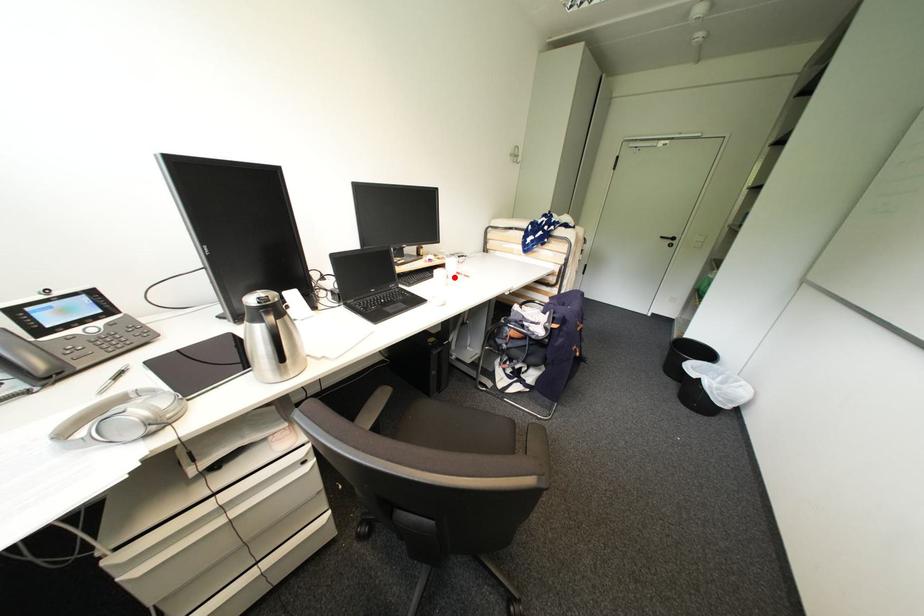
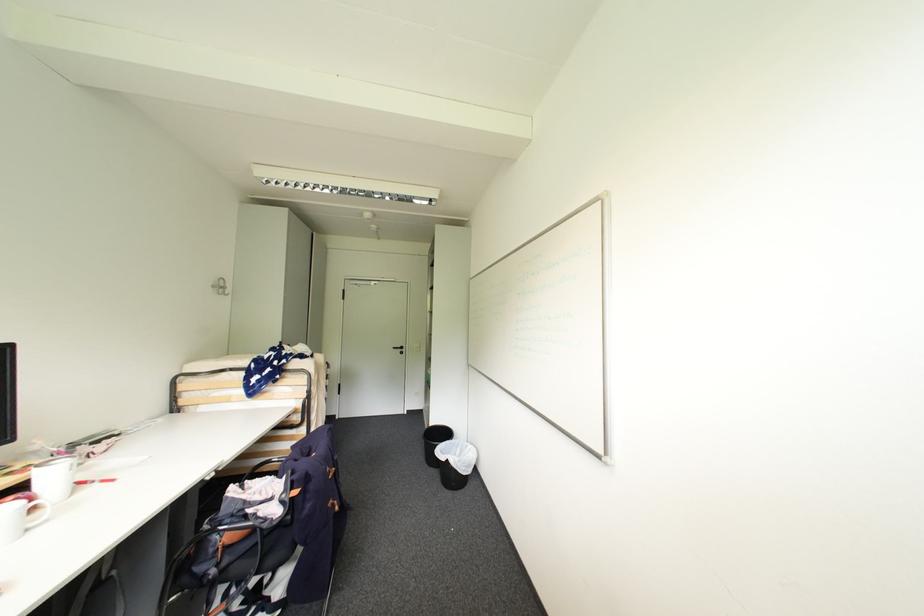
Locate, in the second image, the point that corresponds to the highlighted location in the first image.

(41, 509)